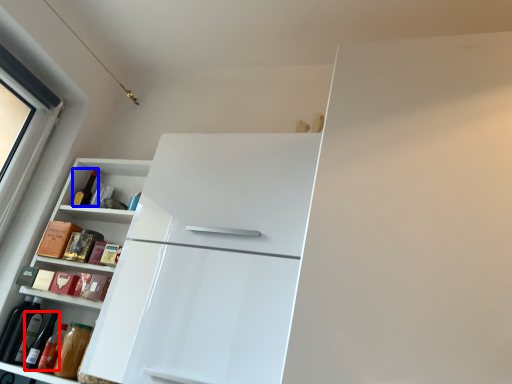
Question: Which of the following is the farthest to the observer, wine bottle (highlighted by a red box) or bottle (highlighted by a blue box)?

Choices:
 (A) wine bottle
 (B) bottle

Answer: (B)